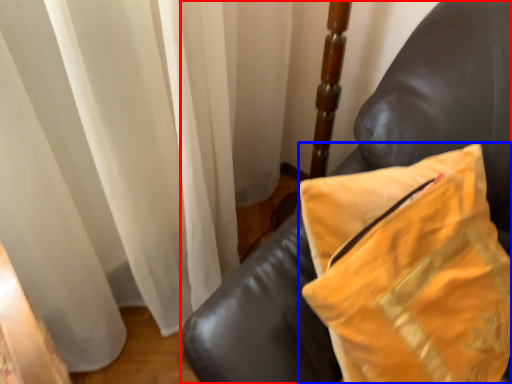
Question: Which point is further to the camera, furniture (highlighted by a red box) or pillow (highlighted by a blue box)?

Choices:
 (A) furniture
 (B) pillow

Answer: (A)